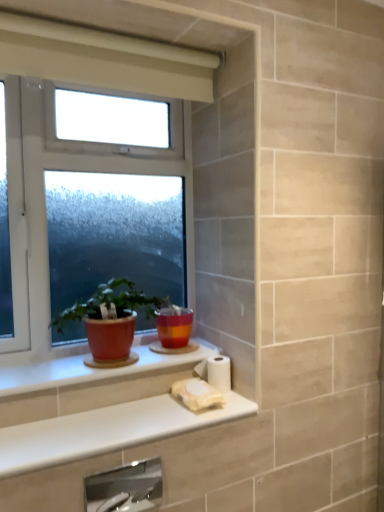
Question: Which direction should I rotate to face white matte toilet paper at lower center, which is the first toilet paper from top to bottom, — up or down?

Choices:
 (A) up
 (B) down

Answer: (B)

Question: Is white glossy counter top at lower center shorter than matte ceramic pot at window?

Choices:
 (A) yes
 (B) no

Answer: (A)

Question: Is white glossy counter top at lower center aimed at matte ceramic pot at window?

Choices:
 (A) yes
 (B) no

Answer: (B)

Question: From the image's perspective, is white glossy counter top at lower center located above matte ceramic pot at window?

Choices:
 (A) no
 (B) yes

Answer: (A)

Question: Can you confirm if white glossy counter top at lower center is positioned to the right of matte ceramic pot at window?

Choices:
 (A) no
 (B) yes

Answer: (B)

Question: From the image's perspective, is white glossy counter top at lower center below matte ceramic pot at window?

Choices:
 (A) yes
 (B) no

Answer: (A)

Question: Does white glossy counter top at lower center have a greater height compared to matte ceramic pot at window?

Choices:
 (A) no
 (B) yes

Answer: (A)

Question: Is satin nickel faucet at lower center at the left side of matte ceramic window sill at lower left?

Choices:
 (A) yes
 (B) no

Answer: (B)

Question: Is satin nickel faucet at lower center smaller than matte ceramic window sill at lower left?

Choices:
 (A) yes
 (B) no

Answer: (A)

Question: Is satin nickel faucet at lower center positioned beyond the bounds of matte ceramic window sill at lower left?

Choices:
 (A) yes
 (B) no

Answer: (A)

Question: Is satin nickel faucet at lower center far from matte ceramic window sill at lower left?

Choices:
 (A) yes
 (B) no

Answer: (B)

Question: Is satin nickel faucet at lower center positioned in front of matte ceramic window sill at lower left?

Choices:
 (A) no
 (B) yes

Answer: (B)

Question: Can you confirm if satin nickel faucet at lower center is positioned to the right of matte ceramic window sill at lower left?

Choices:
 (A) no
 (B) yes

Answer: (B)

Question: Is white plastic window at center at the back of white matte toilet paper at lower center, which is the first toilet paper from top to bottom?

Choices:
 (A) no
 (B) yes

Answer: (A)